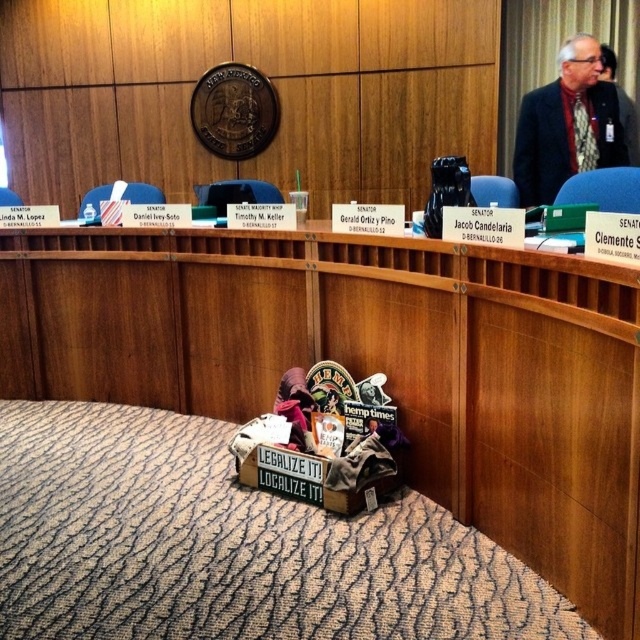
Does wooden box at center come in front of black fabric jacket at upper right?

Yes.

Between wooden box at center and black fabric jacket at upper right, which one is positioned lower?

wooden box at center is below.

Find the location of a particular element. Image resolution: width=640 pixels, height=640 pixels. wooden box at center is located at coordinates (369, 364).

Where is `wooden box at center`? The height and width of the screenshot is (640, 640). wooden box at center is located at coordinates (369, 364).

Is point (584, 38) more distant than point (632, 148)?

Yes, it is.

Which is behind, point (625, 147) or point (625, 100)?

Positioned behind is point (625, 100).

Between point (538, 116) and point (630, 113), which one is positioned behind?

Positioned behind is point (630, 113).

Image resolution: width=640 pixels, height=640 pixels. Find the location of `gray fabric jacket at upper right`. gray fabric jacket at upper right is located at coordinates [x=566, y=125].

Who is taller, wooden box at center or gray fabric jacket at upper right?

With more height is wooden box at center.

Does point (621, 499) come in front of point (554, 180)?

Yes, point (621, 499) is closer to viewer.

Locate an element on the screen. Image resolution: width=640 pixels, height=640 pixels. wooden box at center is located at coordinates (369, 364).